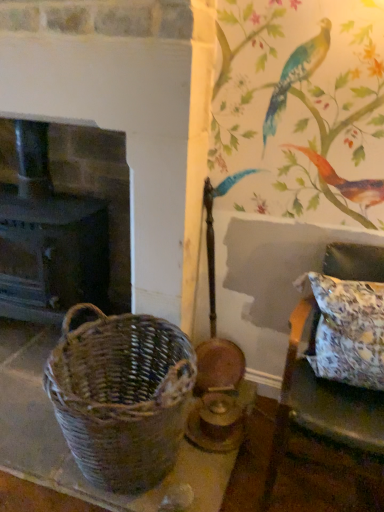
Question: Based on their sizes in the image, would you say dark brown wood fireplace at left is bigger or smaller than floral fabric pillow at right?

Choices:
 (A) big
 (B) small

Answer: (A)

Question: From a real-world perspective, is dark brown wood fireplace at left physically located above or below floral fabric pillow at right?

Choices:
 (A) above
 (B) below

Answer: (A)

Question: Which object is positioned farthest from the floral fabric cushion at right?

Choices:
 (A) floral fabric pillow at right
 (B) woven brown picnic basket at left
 (C) dark brown wood fireplace at left

Answer: (C)

Question: Which of these objects is positioned farthest from the floral fabric pillow at right?

Choices:
 (A) dark brown wood fireplace at left
 (B) woven brown picnic basket at left
 (C) floral fabric cushion at right

Answer: (A)